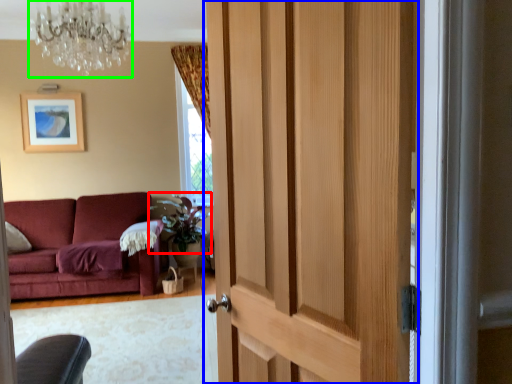
Question: Based on their relative distances, which object is nearer to plant (highlighted by a red box)? Choose from door (highlighted by a blue box) and chandelier (highlighted by a green box).

Choices:
 (A) door
 (B) chandelier

Answer: (B)